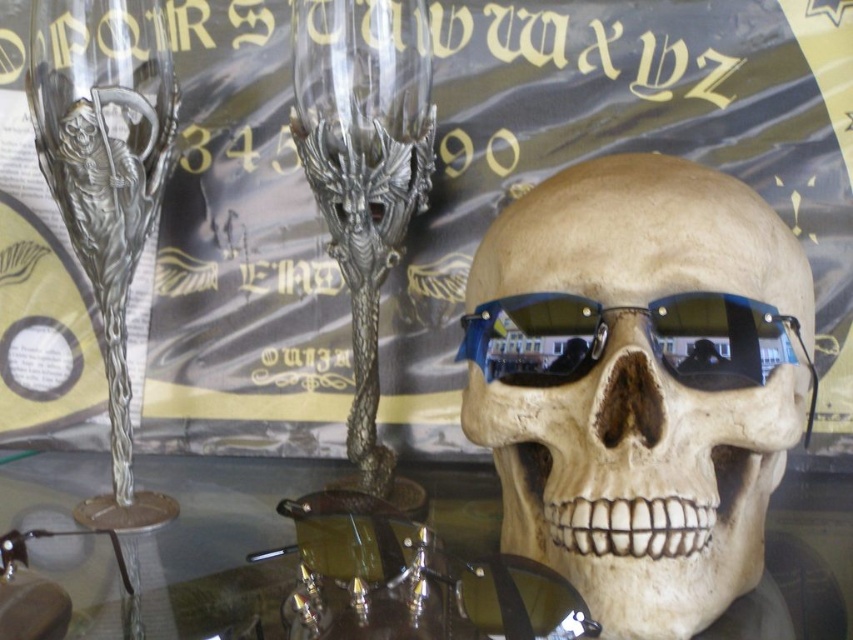
Is metallic silver poster at center shorter than transparent glass table at center?

In fact, metallic silver poster at center may be taller than transparent glass table at center.

Is metallic silver poster at center closer to the viewer compared to transparent glass table at center?

No, it is behind transparent glass table at center.

Image resolution: width=853 pixels, height=640 pixels. I want to click on metallic silver poster at center, so click(621, 150).

Is metallic silver poster at center wider than silver metallic wine glass at left?

Yes, metallic silver poster at center is wider than silver metallic wine glass at left.

Who is more forward, (662, 38) or (90, 51)?

Point (90, 51) is in front.

Where is `metallic silver poster at center`? The width and height of the screenshot is (853, 640). metallic silver poster at center is located at coordinates (621, 150).

Is point (643, 628) positioned in front of point (129, 403)?

Yes, it is.

Which is in front, point (763, 490) or point (151, 202)?

Positioned in front is point (763, 490).

Identify the location of matte plastic skull at center. (x=639, y=384).

Where is `matte plastic skull at center`? matte plastic skull at center is located at coordinates (639, 384).